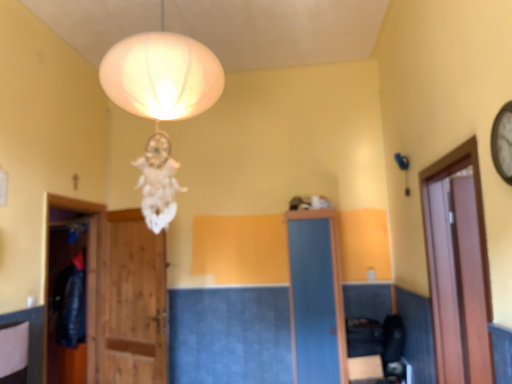
Question: Is wooden door at center thinner than brown wooden door at right?

Choices:
 (A) yes
 (B) no

Answer: (A)

Question: Is the depth of wooden door at center greater than that of brown wooden door at right?

Choices:
 (A) yes
 (B) no

Answer: (A)

Question: Is wooden door at center oriented towards brown wooden door at right?

Choices:
 (A) yes
 (B) no

Answer: (B)

Question: Considering the relative positions of wooden door at center and brown wooden door at right in the image provided, is wooden door at center to the right of brown wooden door at right from the viewer's perspective?

Choices:
 (A) yes
 (B) no

Answer: (B)

Question: Is wooden door at center at the left side of brown wooden door at right?

Choices:
 (A) yes
 (B) no

Answer: (A)

Question: Is wooden door at center touching brown wooden door at right?

Choices:
 (A) no
 (B) yes

Answer: (A)

Question: From the image's perspective, is brown wooden door at right below wooden door at center?

Choices:
 (A) no
 (B) yes

Answer: (A)

Question: Can you confirm if brown wooden door at right is taller than wooden door at center?

Choices:
 (A) yes
 (B) no

Answer: (B)

Question: Is there a large distance between brown wooden door at right and wooden door at center?

Choices:
 (A) yes
 (B) no

Answer: (A)

Question: Would you say brown wooden door at right is outside wooden door at center?

Choices:
 (A) no
 (B) yes

Answer: (B)

Question: Can you confirm if brown wooden door at right is thinner than wooden door at center?

Choices:
 (A) yes
 (B) no

Answer: (B)

Question: Is brown wooden door at right at the left side of wooden door at center?

Choices:
 (A) no
 (B) yes

Answer: (A)

Question: Considering the relative positions of brown wooden door at right and wooden door at center in the image provided, is brown wooden door at right to the left or to the right of wooden door at center?

Choices:
 (A) right
 (B) left

Answer: (A)